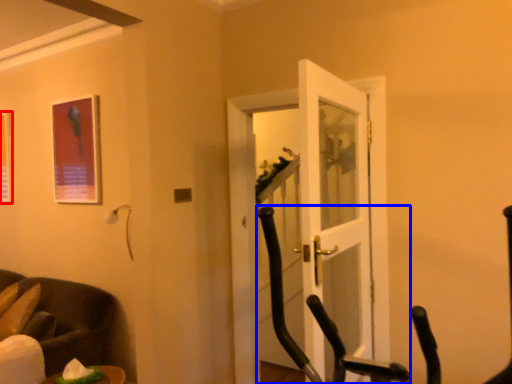
Question: Which point is further to the camera, picture frame (highlighted by a red box) or rocking chair (highlighted by a blue box)?

Choices:
 (A) picture frame
 (B) rocking chair

Answer: (A)